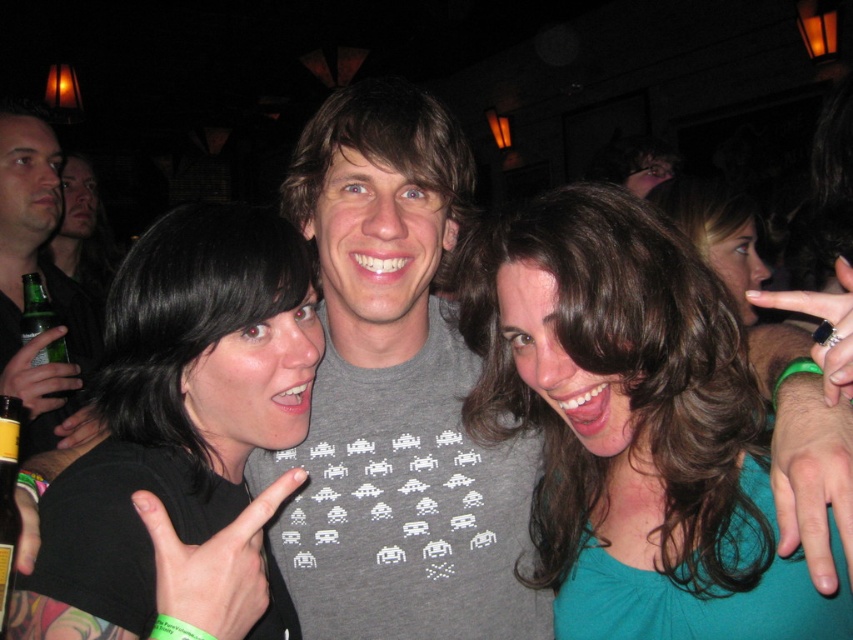
Can you confirm if green matte bottle at left is positioned below green glass bottle at left?

No, green matte bottle at left is not below green glass bottle at left.

Who is more distant from viewer, [64,426] or [35,355]?

Point [35,355]

Image resolution: width=853 pixels, height=640 pixels. What are the coordinates of `green matte bottle at left` in the screenshot? It's located at (45, 284).

Can you confirm if green matte bottle at left is positioned to the right of green glass bottle at lower left?

In fact, green matte bottle at left is to the left of green glass bottle at lower left.

Which is behind, point (73, 397) or point (0, 508)?

Point (73, 397)

You are a GUI agent. You are given a task and a screenshot of the screen. Output one action in this format:
    pyautogui.click(x=<x>, y=<y>)
    Task: Click on the green matte bottle at left
    The width and height of the screenshot is (853, 640).
    Given the screenshot: What is the action you would take?
    pyautogui.click(x=45, y=284)

Describe the element at coordinates (7, 496) in the screenshot. The width and height of the screenshot is (853, 640). I see `green glass bottle at lower left` at that location.

Which is above, green glass bottle at lower left or green glass bottle at left?

Positioned higher is green glass bottle at left.

You are a GUI agent. You are given a task and a screenshot of the screen. Output one action in this format:
    pyautogui.click(x=<x>, y=<y>)
    Task: Click on the green glass bottle at lower left
    This screenshot has height=640, width=853.
    Given the screenshot: What is the action you would take?
    (7, 496)

Locate an element on the screen. This screenshot has width=853, height=640. green glass bottle at lower left is located at coordinates (7, 496).